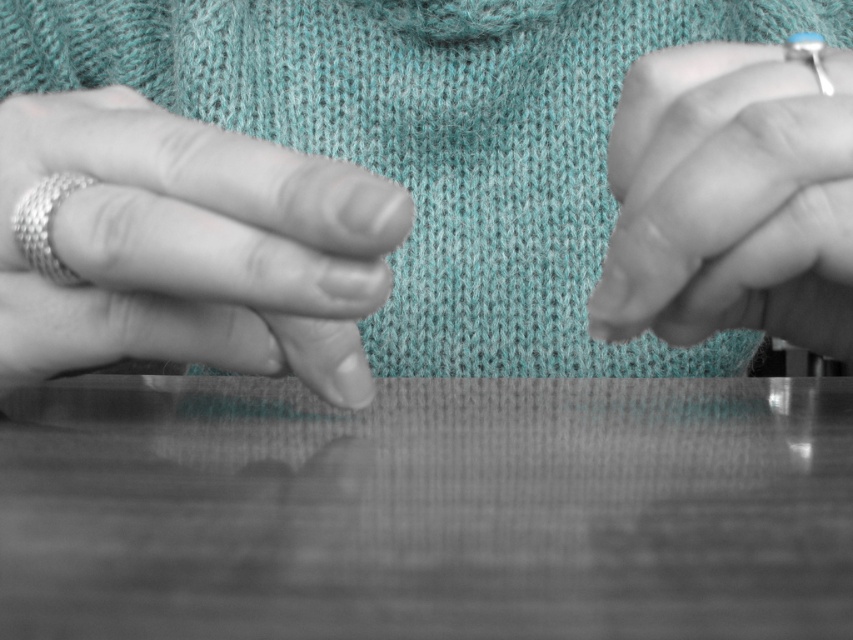
Between metallic ring at left and silver metallic ring at upper right, which one has less height?

metallic ring at left

Between metallic ring at left and silver metallic ring at upper right, which one is positioned lower?

metallic ring at left

This screenshot has width=853, height=640. I want to click on metallic ring at left, so click(190, 246).

Where is `metallic ring at left`? Image resolution: width=853 pixels, height=640 pixels. metallic ring at left is located at coordinates (190, 246).

Who is taller, matte silver ring at center or metallic ring at left?

With more height is matte silver ring at center.

Which is in front, point (833, 353) or point (289, 236)?

Point (289, 236) is more forward.

Is point (364, 364) behind point (201, 193)?

Yes, it is.

Locate an element on the screen. This screenshot has height=640, width=853. matte silver ring at center is located at coordinates (426, 186).

Is matte silver ring at center to the right of silver woven ring at left from the viewer's perspective?

Yes, matte silver ring at center is to the right of silver woven ring at left.

Can you confirm if matte silver ring at center is smaller than silver woven ring at left?

Incorrect, matte silver ring at center is not smaller in size than silver woven ring at left.

This screenshot has width=853, height=640. Describe the element at coordinates (426, 186) in the screenshot. I see `matte silver ring at center` at that location.

The width and height of the screenshot is (853, 640). I want to click on matte silver ring at center, so click(426, 186).